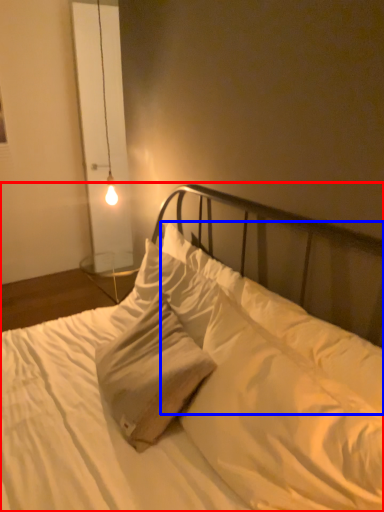
Question: Among these objects, which one is nearest to the camera, bed (highlighted by a red box) or pillow (highlighted by a blue box)?

Choices:
 (A) bed
 (B) pillow

Answer: (A)